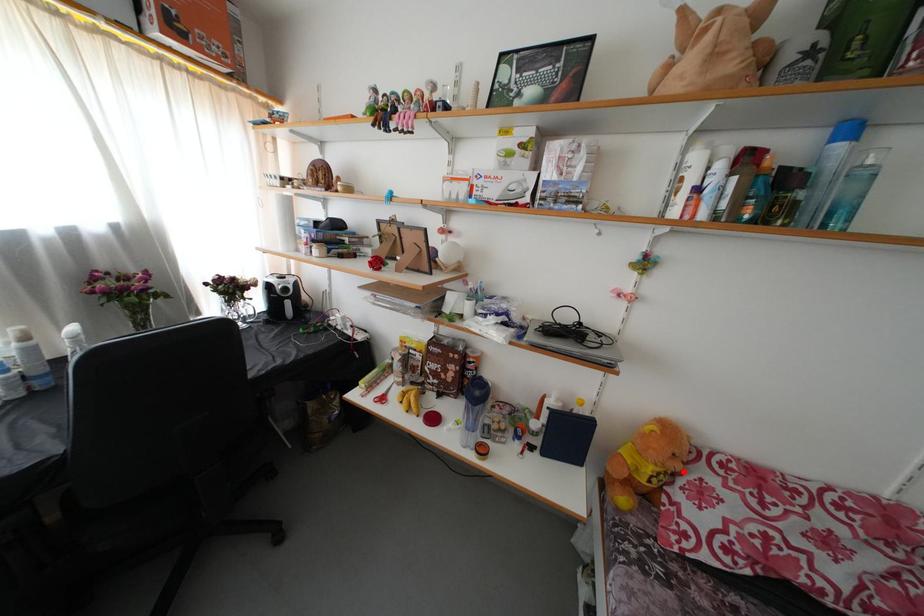
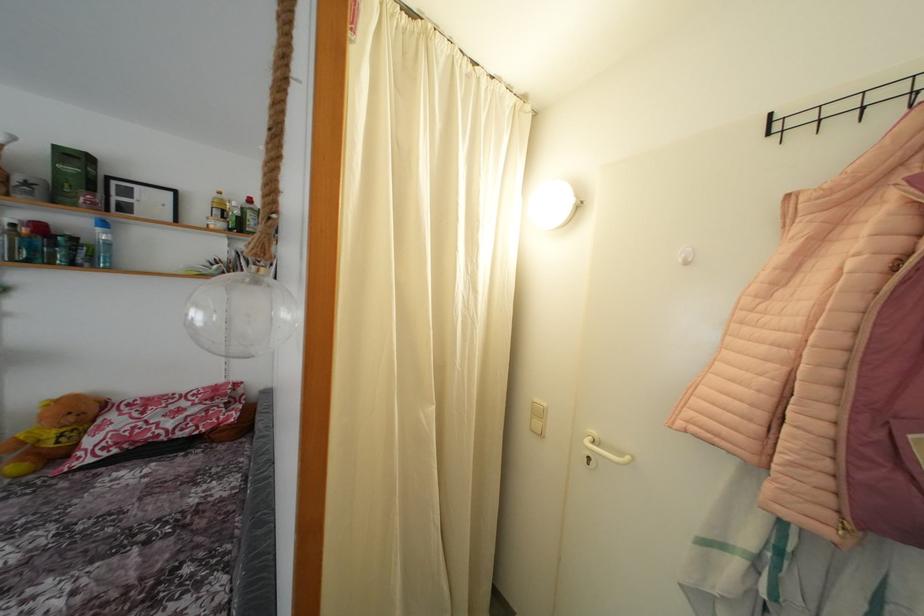
The point at the highlighted location is marked in the first image. Where is the corresponding point in the second image?

(77, 424)